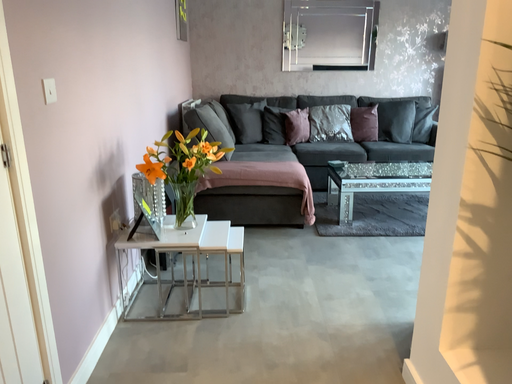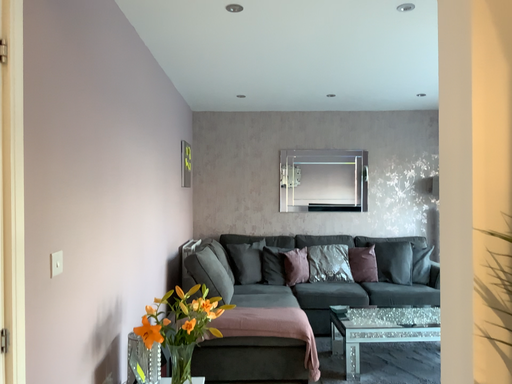
Question: How did the camera likely rotate when shooting the video?

Choices:
 (A) rotated upward
 (B) rotated downward

Answer: (A)